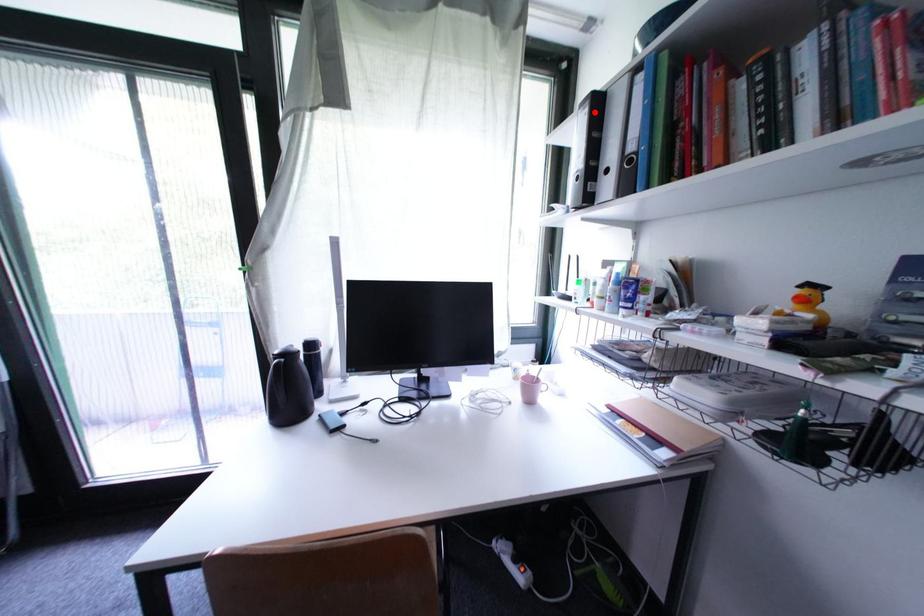
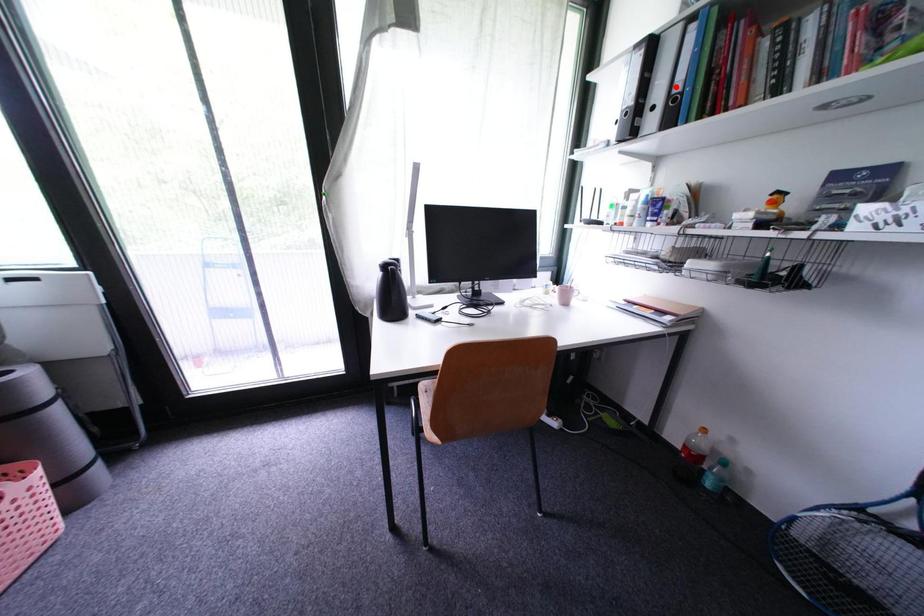
I am providing you with two images of the same scene from different viewpoints. A red point is marked on the first image and another point is marked on the second image. Do the highlighted points in image1 and image2 indicate the same real-world spot?

No